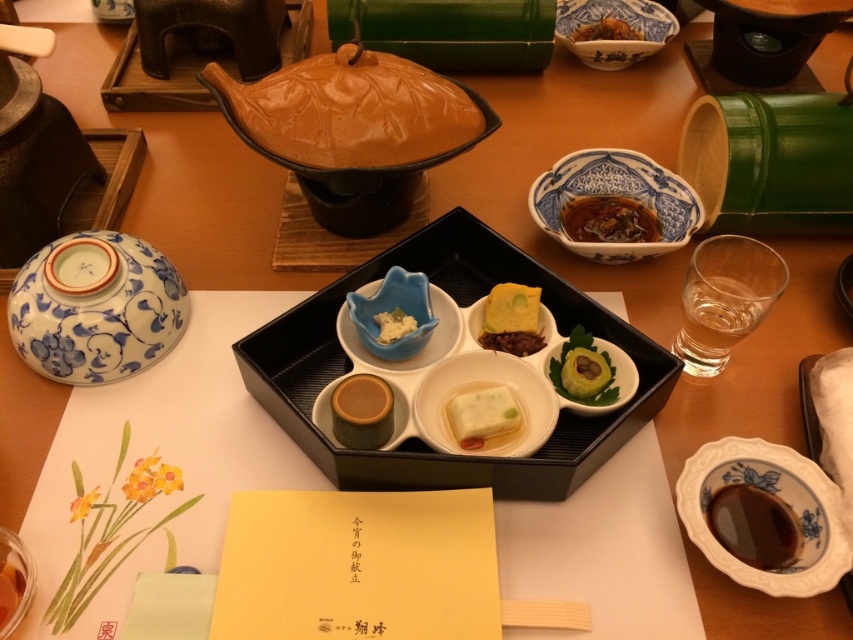
Based on the photo, you are a server at a traditional Japanese restaurant. You need to place a new dish between the green leafy garnish at center and the translucent glass at lower left. The dish is 12 inches wide. Can you fit it between them without moving either object?

The distance between the green leafy garnish at center and the translucent glass at lower left is 20.81 inches. Since the dish is 12 inches wide, there is enough space to place it between them without moving either object.

You are a guest at a traditional Japanese meal and want to reach for the blue and white porcelain bowl at upper right. Which direction should you move your hand relative to the matte brown cylinder at center?

The blue and white porcelain bowl at upper right is to the right of the matte brown cylinder at center, so you should move your hand to the right of the matte brown cylinder at center to reach it.

You are a guest at this traditional Japanese dining setup and want to locate the blue and white porcelain bowl at upper right. According to the coordinates provided, where exactly is it placed on the table?

The blue and white porcelain bowl at upper right is located at the coordinates point [612,29].